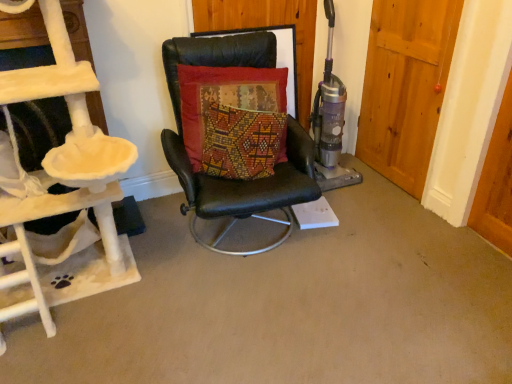
Question: Based on their sizes in the image, would you say beige plush cat tree at left is bigger or smaller than black leather chair at center?

Choices:
 (A) small
 (B) big

Answer: (B)

Question: From a real-world perspective, is beige plush cat tree at left positioned above or below black leather chair at center?

Choices:
 (A) above
 (B) below

Answer: (A)

Question: Estimate the real-world distances between objects in this image. Which object is farther from the velvet cushion at center?

Choices:
 (A) wooden door at right
 (B) black leather chair at center
 (C) beige plush cat tree at left

Answer: (A)

Question: Which object is positioned closest to the black leather chair at center?

Choices:
 (A) wooden door at right
 (B) beige plush cat tree at left
 (C) velvet cushion at center

Answer: (C)